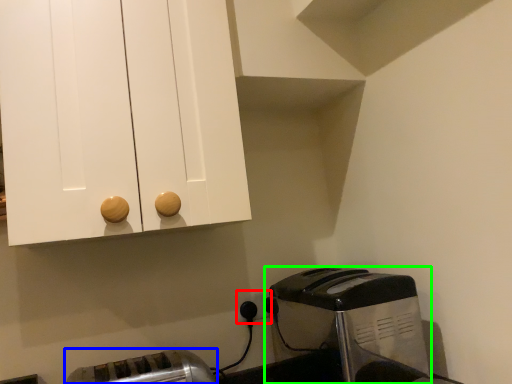
Question: Which object is the closest to the electric outlet (highlighted by a red box)? Choose among these: toaster (highlighted by a blue box) or toaster (highlighted by a green box).

Choices:
 (A) toaster
 (B) toaster

Answer: (B)